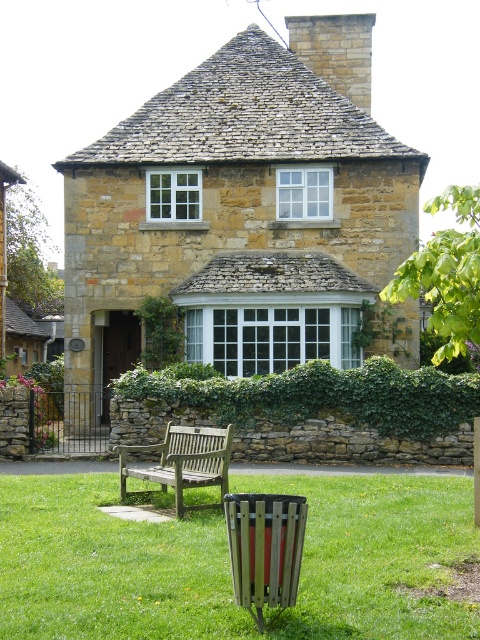
Question: Which object appears farthest from the camera in this image?

Choices:
 (A) stone textured cottage at center
 (B) green ivy hedge at center

Answer: (A)

Question: Is green grass at lower center positioned before green ivy hedge at center?

Choices:
 (A) yes
 (B) no

Answer: (A)

Question: Which point is closer to the camera?

Choices:
 (A) stone textured cottage at center
 (B) green ivy hedge at center
 (C) green grass at lower center

Answer: (C)

Question: Where is stone textured cottage at center located in relation to green grass at lower center in the image?

Choices:
 (A) above
 (B) below

Answer: (A)

Question: Can you confirm if stone textured cottage at center is thinner than green ivy hedge at center?

Choices:
 (A) no
 (B) yes

Answer: (A)

Question: Which point appears farthest from the camera in this image?

Choices:
 (A) (381, 214)
 (B) (219, 472)
 (C) (142, 381)
 (D) (43, 637)

Answer: (A)